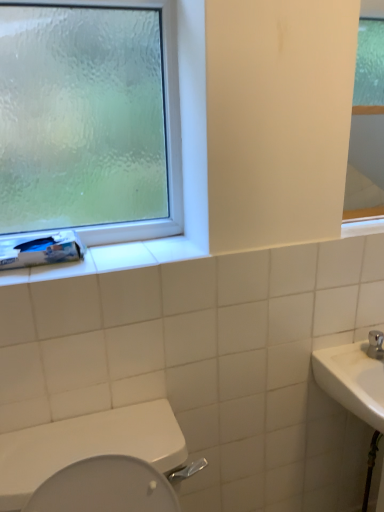
Question: Is white matte toilet paper at left wider than frosted glass window at upper left?

Choices:
 (A) yes
 (B) no

Answer: (A)

Question: Is white matte toilet paper at left outside frosted glass window at upper left?

Choices:
 (A) yes
 (B) no

Answer: (A)

Question: Is the position of white matte toilet paper at left more distant than that of frosted glass window at upper left?

Choices:
 (A) yes
 (B) no

Answer: (A)

Question: From the image's perspective, is white matte toilet paper at left located beneath frosted glass window at upper left?

Choices:
 (A) yes
 (B) no

Answer: (A)

Question: Is white matte toilet paper at left oriented towards frosted glass window at upper left?

Choices:
 (A) yes
 (B) no

Answer: (B)

Question: From a real-world perspective, relative to white glossy toilet at lower left, is frosted glass window at upper left vertically above or below?

Choices:
 (A) below
 (B) above

Answer: (B)

Question: Would you say frosted glass window at upper left is to the left or to the right of white glossy toilet at lower left in the picture?

Choices:
 (A) right
 (B) left

Answer: (B)

Question: From the image's perspective, is frosted glass window at upper left above or below white glossy toilet at lower left?

Choices:
 (A) above
 (B) below

Answer: (A)

Question: From their relative heights in the image, would you say frosted glass window at upper left is taller or shorter than white glossy toilet at lower left?

Choices:
 (A) tall
 (B) short

Answer: (A)

Question: Considering the positions of point (155, 460) and point (374, 187), is point (155, 460) closer or farther from the camera than point (374, 187)?

Choices:
 (A) closer
 (B) farther

Answer: (A)

Question: From a real-world perspective, is white glossy toilet at lower left physically located above or below white glossy mirror at upper right?

Choices:
 (A) below
 (B) above

Answer: (A)

Question: In terms of size, does white glossy toilet at lower left appear bigger or smaller than white glossy mirror at upper right?

Choices:
 (A) small
 (B) big

Answer: (B)

Question: Considering the positions of white glossy toilet at lower left and white glossy mirror at upper right in the image, is white glossy toilet at lower left wider or thinner than white glossy mirror at upper right?

Choices:
 (A) thin
 (B) wide

Answer: (B)

Question: Is white glossy toilet at lower left situated inside frosted glass window at upper left or outside?

Choices:
 (A) inside
 (B) outside

Answer: (B)

Question: From the image's perspective, is white glossy toilet at lower left positioned above or below frosted glass window at upper left?

Choices:
 (A) above
 (B) below

Answer: (B)